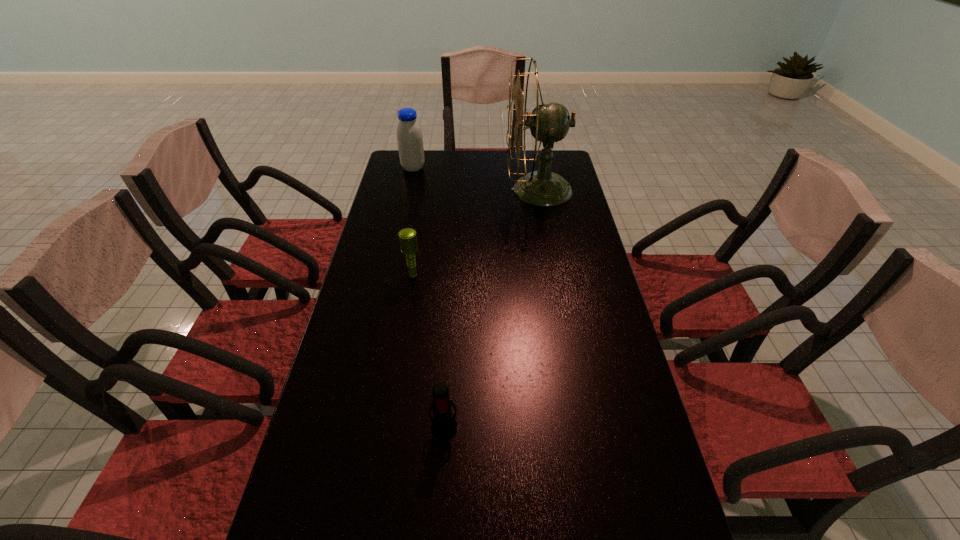
Locate an element on the screen. This screenshot has height=540, width=960. vacant space located 0.330m on the front of the second tallest object is located at coordinates (401, 222).

I want to click on free space located 0.340m on the front of the farther microphone, so click(396, 375).

Find the location of `free space located 0.140m on the front of the right microphone`. free space located 0.140m on the front of the right microphone is located at coordinates (439, 508).

Identify the location of fan that is at the far edge. The width and height of the screenshot is (960, 540). (549, 122).

Identify the location of soya milk located at the far edge. pyautogui.click(x=409, y=134).

Where is `soya milk that is positioned at the left edge`? Image resolution: width=960 pixels, height=540 pixels. soya milk that is positioned at the left edge is located at coordinates (409, 134).

I want to click on microphone located in the left edge section of the desktop, so click(408, 239).

The width and height of the screenshot is (960, 540). What are the coordinates of `object that is positioned at the right edge` in the screenshot? It's located at (549, 122).

I want to click on object situated at the far left corner, so click(x=409, y=134).

Locate an element on the screen. Image resolution: width=960 pixels, height=540 pixels. object positioned at the far right corner is located at coordinates (549, 122).